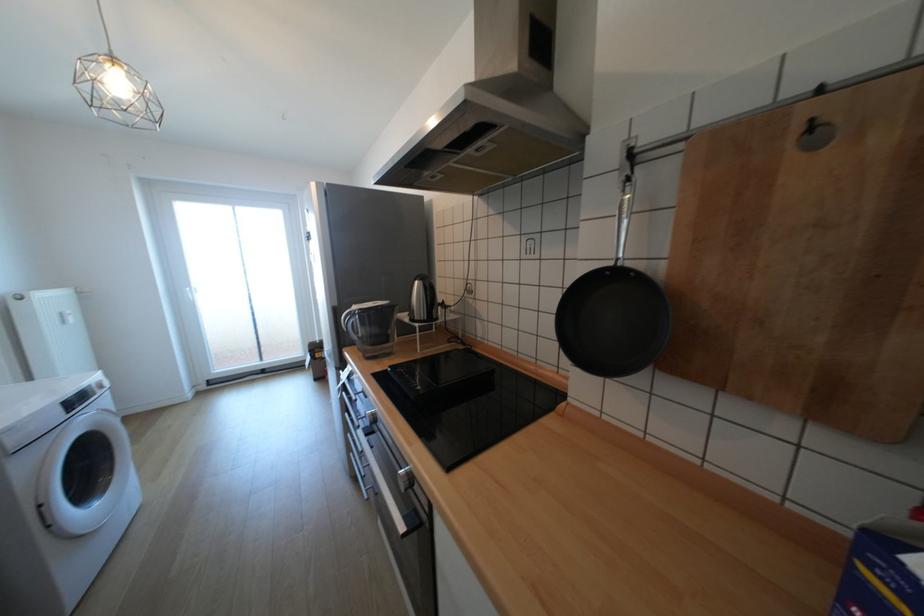
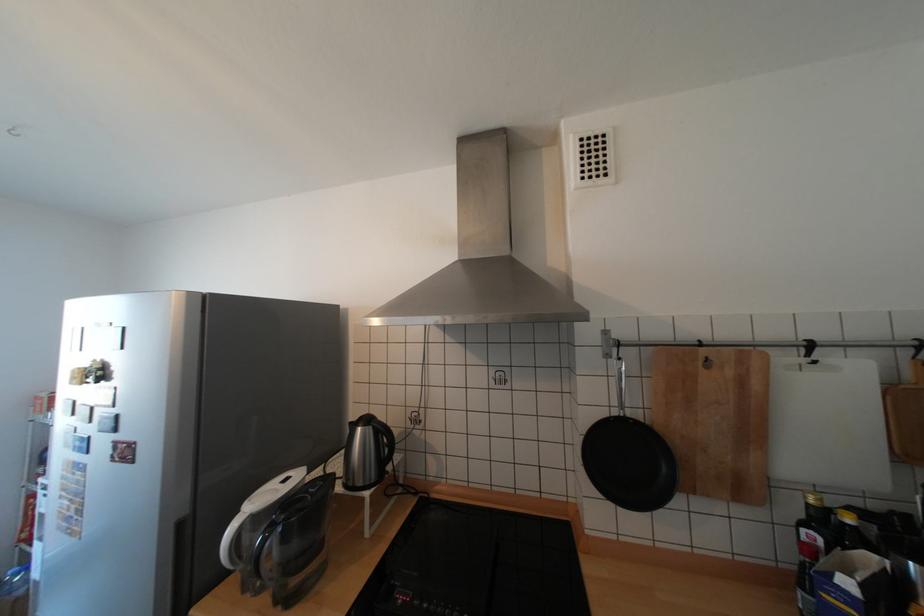
Where in the second image is the point corresponding to the point at 438,302 from the first image?

(392, 453)